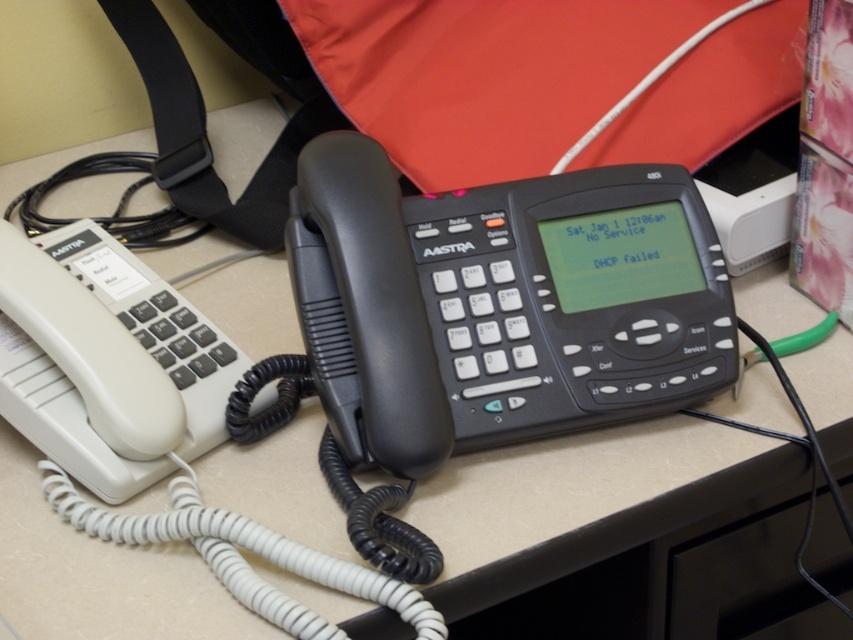
Can you confirm if white matte/soft plastic phone at left is smaller than white cord at lower left?

Actually, white matte/soft plastic phone at left might be larger than white cord at lower left.

Between white matte/soft plastic phone at left and white cord at lower left, which one appears on the right side from the viewer's perspective?

white cord at lower left is more to the right.

In order to click on white matte/soft plastic phone at left in this screenshot , I will do `click(106, 360)`.

At what (x,y) coordinates should I click in order to perform the action: click on white matte/soft plastic phone at left. Please return your answer as a coordinate pair (x, y). The height and width of the screenshot is (640, 853). Looking at the image, I should click on (106, 360).